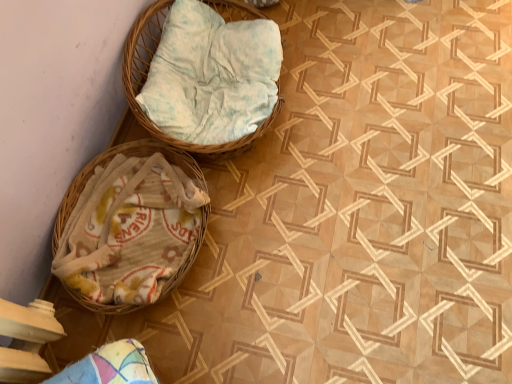
At what (x,y) coordinates should I click in order to perform the action: click on woven wicker basket at upper center, the first basket positioned from the top. Please return your answer as a coordinate pair (x, y). Image resolution: width=512 pixels, height=384 pixels. Looking at the image, I should click on (146, 77).

What is the approximate width of woven wicker basket at upper center, the first basket positioned from the top?

woven wicker basket at upper center, the first basket positioned from the top, is 19.14 inches in width.

What do you see at coordinates (146, 77) in the screenshot? I see `woven wicker basket at upper center, marked as the 2th basket in a bottom-to-top arrangement` at bounding box center [146, 77].

Describe the element at coordinates (129, 227) in the screenshot. I see `white woven basket at left, which appears as the 1th basket when ordered from the bottom` at that location.

Image resolution: width=512 pixels, height=384 pixels. In order to click on white woven basket at left, which appears as the 2th basket when viewed from the top in this screenshot , I will do `click(129, 227)`.

In order to face white woven basket at left, which appears as the 1th basket when ordered from the bottom, should I rotate leftwards or rightwards?

Rotate your view left by about 15.462°.

Image resolution: width=512 pixels, height=384 pixels. What are the coordinates of `woven wicker basket at upper center, marked as the 2th basket in a bottom-to-top arrangement` in the screenshot? It's located at (146, 77).

Can you confirm if woven wicker basket at upper center, marked as the 2th basket in a bottom-to-top arrangement, is positioned to the right of white woven basket at left, which appears as the 1th basket when ordered from the bottom?

Yes.

Is woven wicker basket at upper center, marked as the 2th basket in a bottom-to-top arrangement, further to the viewer compared to white woven basket at left, which appears as the 1th basket when ordered from the bottom?

Yes, woven wicker basket at upper center, marked as the 2th basket in a bottom-to-top arrangement, is further from the viewer.

Between point (135, 109) and point (84, 203), which one is positioned behind?

The point (135, 109) is more distant.

From the image's perspective, is woven wicker basket at upper center, marked as the 2th basket in a bottom-to-top arrangement, on top of white woven basket at left, which appears as the 1th basket when ordered from the bottom?

Yes, from the image's perspective, woven wicker basket at upper center, marked as the 2th basket in a bottom-to-top arrangement, is on top of white woven basket at left, which appears as the 1th basket when ordered from the bottom.

From a real-world perspective, between woven wicker basket at upper center, marked as the 2th basket in a bottom-to-top arrangement, and white woven basket at left, which appears as the 1th basket when ordered from the bottom, who is vertically higher?

woven wicker basket at upper center, marked as the 2th basket in a bottom-to-top arrangement.

Considering the relative sizes of woven wicker basket at upper center, the first basket positioned from the top, and white woven basket at left, which appears as the 1th basket when ordered from the bottom, in the image provided, is woven wicker basket at upper center, the first basket positioned from the top, thinner than white woven basket at left, which appears as the 1th basket when ordered from the bottom,?

No, woven wicker basket at upper center, the first basket positioned from the top, is not thinner than white woven basket at left, which appears as the 1th basket when ordered from the bottom.

Is woven wicker basket at upper center, marked as the 2th basket in a bottom-to-top arrangement, shorter than white woven basket at left, which appears as the 2th basket when viewed from the top?

No.

Between woven wicker basket at upper center, the first basket positioned from the top, and white woven basket at left, which appears as the 2th basket when viewed from the top, which one has larger size?

With larger size is woven wicker basket at upper center, the first basket positioned from the top.

Is woven wicker basket at upper center, the first basket positioned from the top, completely or partially outside of white woven basket at left, which appears as the 1th basket when ordered from the bottom?

Yes.

Is woven wicker basket at upper center, the first basket positioned from the top, next to white woven basket at left, which appears as the 2th basket when viewed from the top?

woven wicker basket at upper center, the first basket positioned from the top, and white woven basket at left, which appears as the 2th basket when viewed from the top, are clearly separated.

Is woven wicker basket at upper center, the first basket positioned from the top, aimed at white woven basket at left, which appears as the 1th basket when ordered from the bottom?

No, woven wicker basket at upper center, the first basket positioned from the top, is not oriented towards white woven basket at left, which appears as the 1th basket when ordered from the bottom.

How many degrees apart are the facing directions of woven wicker basket at upper center, marked as the 2th basket in a bottom-to-top arrangement, and white woven basket at left, which appears as the 2th basket when viewed from the top?

The facing directions of woven wicker basket at upper center, marked as the 2th basket in a bottom-to-top arrangement, and white woven basket at left, which appears as the 2th basket when viewed from the top, are 0.000238 degrees apart.

Locate an element on the screen. The width and height of the screenshot is (512, 384). basket behind the white woven basket at left, which appears as the 1th basket when ordered from the bottom is located at coordinates (146, 77).

Is white woven basket at left, which appears as the 1th basket when ordered from the bottom, to the left or to the right of woven wicker basket at upper center, the first basket positioned from the top, in the image?

From the image, it's evident that white woven basket at left, which appears as the 1th basket when ordered from the bottom, is to the left of woven wicker basket at upper center, the first basket positioned from the top.

Is the position of white woven basket at left, which appears as the 2th basket when viewed from the top, more distant than that of woven wicker basket at upper center, the first basket positioned from the top?

No, white woven basket at left, which appears as the 2th basket when viewed from the top, is closer to the viewer.

Considering the points (102, 179) and (152, 52), which point is behind, point (102, 179) or point (152, 52)?

The point (152, 52) is farther.

In the scene shown: From the image's perspective, would you say white woven basket at left, which appears as the 2th basket when viewed from the top, is shown under woven wicker basket at upper center, the first basket positioned from the top?

Indeed, from the image's perspective, white woven basket at left, which appears as the 2th basket when viewed from the top, is shown beneath woven wicker basket at upper center, the first basket positioned from the top.

From a real-world perspective, is white woven basket at left, which appears as the 2th basket when viewed from the top, physically above woven wicker basket at upper center, the first basket positioned from the top?

Incorrect, from a real-world perspective, white woven basket at left, which appears as the 2th basket when viewed from the top, is lower than woven wicker basket at upper center, the first basket positioned from the top.

Does white woven basket at left, which appears as the 2th basket when viewed from the top, have a greater width compared to woven wicker basket at upper center, the first basket positioned from the top?

In fact, white woven basket at left, which appears as the 2th basket when viewed from the top, might be narrower than woven wicker basket at upper center, the first basket positioned from the top.

Is white woven basket at left, which appears as the 1th basket when ordered from the bottom, taller than woven wicker basket at upper center, marked as the 2th basket in a bottom-to-top arrangement?

No, white woven basket at left, which appears as the 1th basket when ordered from the bottom, is not taller than woven wicker basket at upper center, marked as the 2th basket in a bottom-to-top arrangement.

Based on the photo, can you confirm if white woven basket at left, which appears as the 2th basket when viewed from the top, is bigger than woven wicker basket at upper center, the first basket positioned from the top?

No, white woven basket at left, which appears as the 2th basket when viewed from the top, is not bigger than woven wicker basket at upper center, the first basket positioned from the top.

Would you say white woven basket at left, which appears as the 2th basket when viewed from the top, is inside or outside woven wicker basket at upper center, the first basket positioned from the top?

white woven basket at left, which appears as the 2th basket when viewed from the top, is located beyond the bounds of woven wicker basket at upper center, the first basket positioned from the top.

Is white woven basket at left, which appears as the 1th basket when ordered from the bottom, next to woven wicker basket at upper center, the first basket positioned from the top?

They are not placed beside each other.

Is white woven basket at left, which appears as the 1th basket when ordered from the bottom, facing away from woven wicker basket at upper center, the first basket positioned from the top?

white woven basket at left, which appears as the 1th basket when ordered from the bottom, does not have its back to woven wicker basket at upper center, the first basket positioned from the top.

Can you tell me how much white woven basket at left, which appears as the 1th basket when ordered from the bottom, and woven wicker basket at upper center, marked as the 2th basket in a bottom-to-top arrangement, differ in facing direction?

white woven basket at left, which appears as the 1th basket when ordered from the bottom, and woven wicker basket at upper center, marked as the 2th basket in a bottom-to-top arrangement, are facing 0.000238 degrees away from each other.

Where is `basket below the woven wicker basket at upper center, the first basket positioned from the top (from the image's perspective)`? basket below the woven wicker basket at upper center, the first basket positioned from the top (from the image's perspective) is located at coordinates (129, 227).

In the image, there is a woven wicker basket at upper center, the first basket positioned from the top. At what (x,y) coordinates should I click in order to perform the action: click on basket below it (from the image's perspective). Please return your answer as a coordinate pair (x, y). Image resolution: width=512 pixels, height=384 pixels. Looking at the image, I should click on (129, 227).

Identify the location of basket above the white woven basket at left, which appears as the 2th basket when viewed from the top (from a real-world perspective). (146, 77).